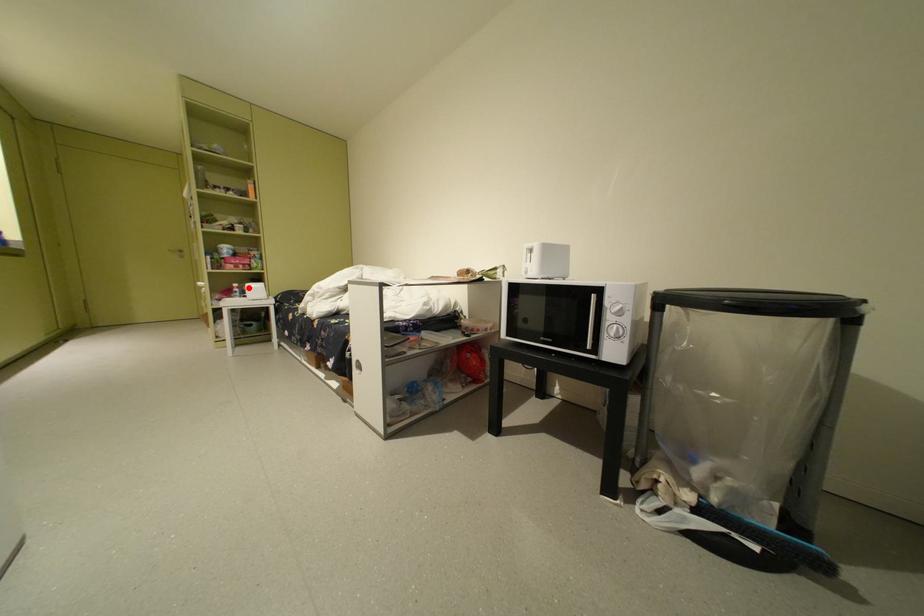
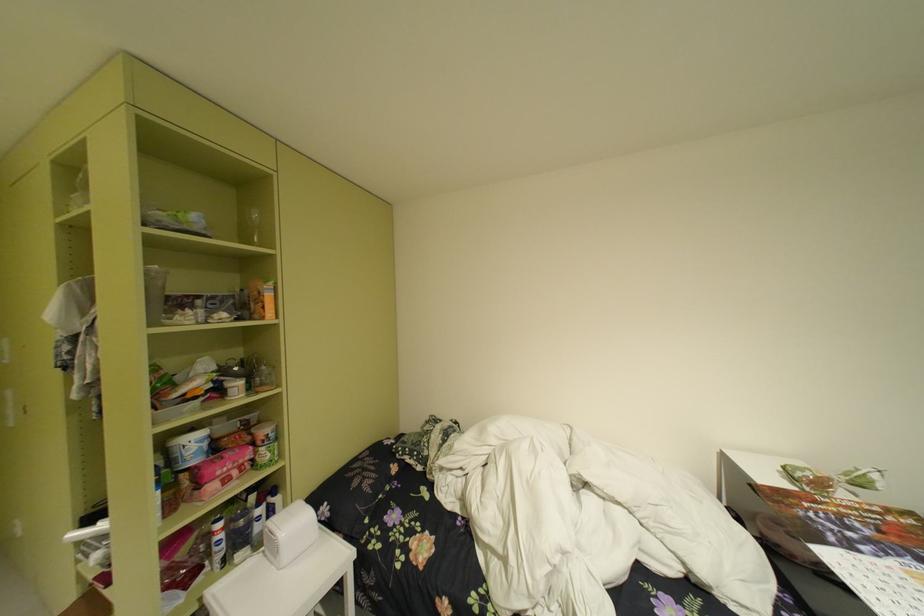
The point at the highlighted location is marked in the first image. Where is the corresponding point in the second image?

(235, 528)